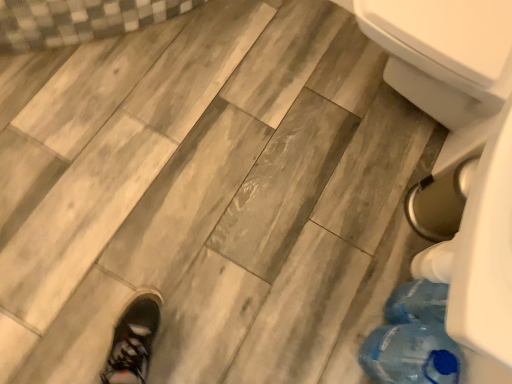
Question: Which is correct: transparent plastic bottle at lower right is inside white plastic bidet at lower right, or outside of it?

Choices:
 (A) inside
 (B) outside

Answer: (B)

Question: Considering the positions of transparent plastic bottle at lower right and white plastic bidet at lower right in the image, is transparent plastic bottle at lower right bigger or smaller than white plastic bidet at lower right?

Choices:
 (A) small
 (B) big

Answer: (A)

Question: From their relative heights in the image, would you say transparent plastic bottle at lower right is taller or shorter than white plastic bidet at lower right?

Choices:
 (A) short
 (B) tall

Answer: (A)

Question: Is point (434, 54) positioned closer to the camera than point (442, 342)?

Choices:
 (A) closer
 (B) farther

Answer: (B)

Question: Is white plastic bidet at lower right to the left or to the right of transparent plastic bottle at lower right in the image?

Choices:
 (A) right
 (B) left

Answer: (A)

Question: In the image, is white plastic bidet at lower right positioned in front of or behind transparent plastic bottle at lower right?

Choices:
 (A) behind
 (B) front

Answer: (A)

Question: Choose the correct answer: Is white plastic bidet at lower right inside transparent plastic bottle at lower right or outside it?

Choices:
 (A) inside
 (B) outside

Answer: (B)